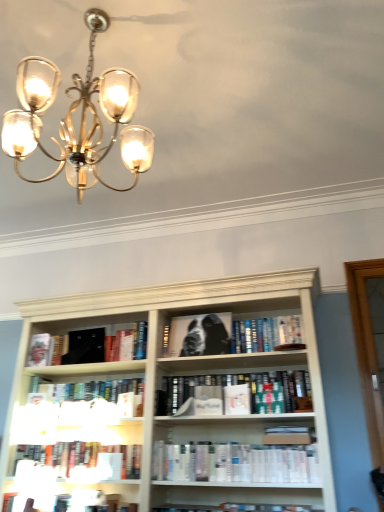
Question: From the image's perspective, is black matte book at left, the second book positioned from the top, over matte gold chandelier at upper left?

Choices:
 (A) no
 (B) yes

Answer: (A)

Question: Does black matte book at left, placed as the 7th book when sorted from bottom to top, have a smaller size compared to matte gold chandelier at upper left?

Choices:
 (A) yes
 (B) no

Answer: (A)

Question: Is black matte book at left, placed as the 7th book when sorted from bottom to top, shorter than matte gold chandelier at upper left?

Choices:
 (A) yes
 (B) no

Answer: (A)

Question: Is black matte book at left, placed as the 7th book when sorted from bottom to top, behind matte gold chandelier at upper left?

Choices:
 (A) no
 (B) yes

Answer: (B)

Question: Is black matte book at left, the second book positioned from the top, touching matte gold chandelier at upper left?

Choices:
 (A) no
 (B) yes

Answer: (A)

Question: Considering the positions of hardcover book at left, the 1th paperback book from the left, and black matte book at upper left, the 2th paperback book viewed from the back, in the image, is hardcover book at left, the 1th paperback book from the left, bigger or smaller than black matte book at upper left, the 2th paperback book viewed from the back,?

Choices:
 (A) big
 (B) small

Answer: (B)

Question: Is hardcover book at left, arranged as the 4th paperback book when viewed from the right, taller or shorter than black matte book at upper left, the 2th paperback book viewed from the back?

Choices:
 (A) short
 (B) tall

Answer: (A)

Question: From the image's perspective, relative to black matte book at upper left, marked as the 3th paperback book in a front-to-back arrangement, is hardcover book at left, arranged as the 4th paperback book when viewed from the right, above or below?

Choices:
 (A) above
 (B) below

Answer: (B)

Question: Considering the positions of hardcover book at left, arranged as the 4th paperback book when viewed from the right, and black matte book at upper left, the second paperback book from the left, in the image, is hardcover book at left, arranged as the 4th paperback book when viewed from the right, wider or thinner than black matte book at upper left, the second paperback book from the left,?

Choices:
 (A) wide
 (B) thin

Answer: (B)

Question: From a real-world perspective, relative to matte gold chandelier at upper left, is white matte book at center, which is the fifth book in bottom-to-top order, vertically above or below?

Choices:
 (A) below
 (B) above

Answer: (A)

Question: Is white matte book at center, placed as the 4th book when sorted from top to bottom, spatially inside matte gold chandelier at upper left, or outside of it?

Choices:
 (A) inside
 (B) outside

Answer: (B)

Question: Based on their sizes in the image, would you say white matte book at center, which is the fifth book in bottom-to-top order, is bigger or smaller than matte gold chandelier at upper left?

Choices:
 (A) big
 (B) small

Answer: (B)

Question: From the image's perspective, is white matte book at center, placed as the 4th book when sorted from top to bottom, above or below matte gold chandelier at upper left?

Choices:
 (A) below
 (B) above

Answer: (A)

Question: Considering the positions of black matte book at center, the 8th book in the bottom-to-top sequence, and hardcover book at center, which is the 1th paperback book from front to back, in the image, is black matte book at center, the 8th book in the bottom-to-top sequence, bigger or smaller than hardcover book at center, which is the 1th paperback book from front to back,?

Choices:
 (A) small
 (B) big

Answer: (B)

Question: Is point (205, 342) closer or farther from the camera than point (231, 387)?

Choices:
 (A) closer
 (B) farther

Answer: (B)